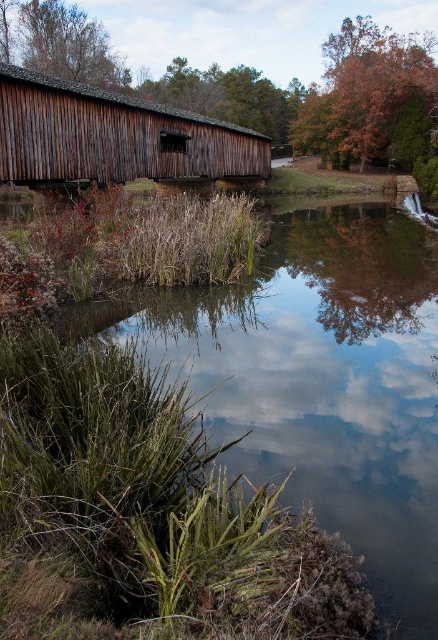
Question: Which of the following is the farthest from the observer?

Choices:
 (A) (212, 131)
 (B) (272, 360)

Answer: (A)

Question: Is green grassy water at lower left smaller than wooden bridge at left?

Choices:
 (A) no
 (B) yes

Answer: (B)

Question: Which point appears farthest from the camera in this image?

Choices:
 (A) (126, 161)
 (B) (202, 308)

Answer: (A)

Question: In this image, where is green grassy water at lower left located relative to wooden bridge at left?

Choices:
 (A) right
 (B) left

Answer: (A)

Question: Which of the following is the farthest from the observer?

Choices:
 (A) green grassy water at lower left
 (B) wooden bridge at left

Answer: (B)

Question: From the image, what is the correct spatial relationship of green grassy water at lower left in relation to wooden bridge at left?

Choices:
 (A) left
 (B) right

Answer: (B)